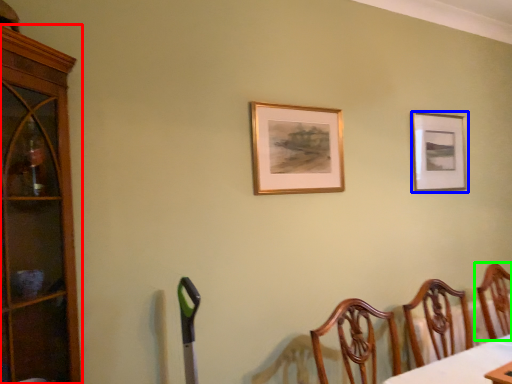
Question: Considering the real-world distances, which object is farthest from cabinetry (highlighted by a red box)? picture frame (highlighted by a blue box) or chair (highlighted by a green box)?

Choices:
 (A) picture frame
 (B) chair

Answer: (B)